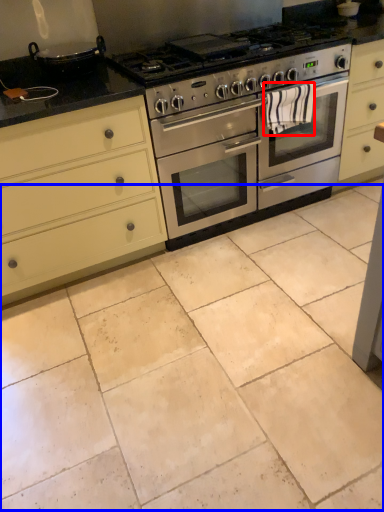
Question: Which of the following is the closest to the observer, material (highlighted by a red box) or ceramic tile (highlighted by a blue box)?

Choices:
 (A) material
 (B) ceramic tile

Answer: (B)